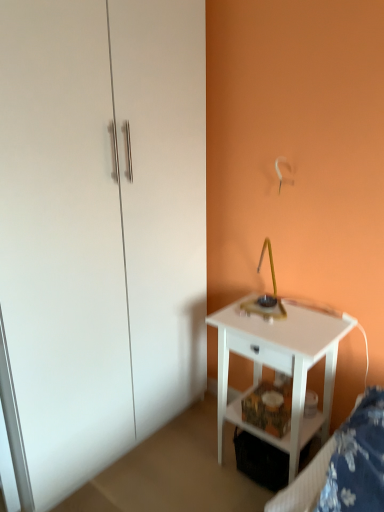
Question: Is white glossy dresser at left at the left side of white fabric bed frame at lower right?

Choices:
 (A) no
 (B) yes

Answer: (B)

Question: Is white glossy dresser at left aimed at white fabric bed frame at lower right?

Choices:
 (A) yes
 (B) no

Answer: (A)

Question: Does white glossy dresser at left lie behind white fabric bed frame at lower right?

Choices:
 (A) yes
 (B) no

Answer: (A)

Question: From the image's perspective, would you say white glossy dresser at left is positioned over white fabric bed frame at lower right?

Choices:
 (A) no
 (B) yes

Answer: (B)

Question: Can you confirm if white glossy dresser at left is thinner than white fabric bed frame at lower right?

Choices:
 (A) yes
 (B) no

Answer: (B)

Question: Is white fabric bed frame at lower right surrounded by white glossy dresser at left?

Choices:
 (A) yes
 (B) no

Answer: (B)

Question: Is white glossy nightstand at lower right smaller than white glossy dresser at left?

Choices:
 (A) no
 (B) yes

Answer: (B)

Question: Considering the relative positions of white glossy nightstand at lower right and white glossy dresser at left in the image provided, is white glossy nightstand at lower right to the right of white glossy dresser at left from the viewer's perspective?

Choices:
 (A) no
 (B) yes

Answer: (B)

Question: Could you tell me if white glossy nightstand at lower right is facing white glossy dresser at left?

Choices:
 (A) yes
 (B) no

Answer: (B)

Question: From the image's perspective, is white glossy nightstand at lower right above white glossy dresser at left?

Choices:
 (A) yes
 (B) no

Answer: (B)

Question: Are white glossy nightstand at lower right and white glossy dresser at left located far from each other?

Choices:
 (A) no
 (B) yes

Answer: (A)

Question: Is white glossy nightstand at lower right behind white glossy dresser at left?

Choices:
 (A) no
 (B) yes

Answer: (B)

Question: Can white glossy nightstand at lower right be found inside white fabric bed frame at lower right?

Choices:
 (A) no
 (B) yes

Answer: (A)